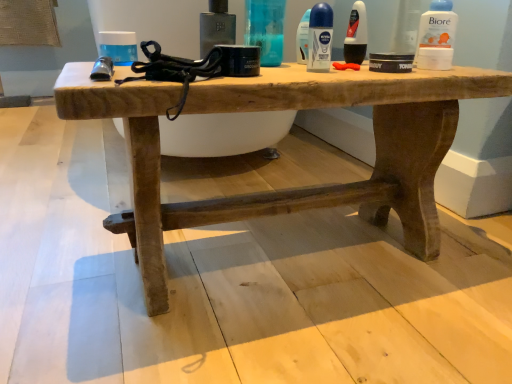
Question: Considering the relative sizes of blue matte deodorant at upper center, acting as the third mouthwash starting from the right, and matte black deodorant at center, the third toiletry viewed from the left, in the image provided, is blue matte deodorant at upper center, acting as the third mouthwash starting from the right, bigger than matte black deodorant at center, the third toiletry viewed from the left,?

Choices:
 (A) yes
 (B) no

Answer: (B)

Question: Considering the relative sizes of blue matte deodorant at upper center, arranged as the first mouthwash when viewed from the back, and matte black deodorant at center, the third toiletry viewed from the left, in the image provided, is blue matte deodorant at upper center, arranged as the first mouthwash when viewed from the back, smaller than matte black deodorant at center, the third toiletry viewed from the left,?

Choices:
 (A) yes
 (B) no

Answer: (A)

Question: Does blue matte deodorant at upper center, acting as the third mouthwash starting from the right, turn towards matte black deodorant at center, placed as the first toiletry when sorted from right to left?

Choices:
 (A) no
 (B) yes

Answer: (A)

Question: Is blue matte deodorant at upper center, arranged as the first mouthwash when viewed from the back, wider than matte black deodorant at center, the third toiletry viewed from the left?

Choices:
 (A) no
 (B) yes

Answer: (A)

Question: From the image's perspective, does blue matte deodorant at upper center, arranged as the first mouthwash when viewed from the back, appear lower than matte black deodorant at center, the third toiletry viewed from the left?

Choices:
 (A) yes
 (B) no

Answer: (A)

Question: Is blue matte deodorant at upper center, which is the 3th mouthwash from front to back, behind matte black deodorant at center, placed as the first toiletry when sorted from right to left?

Choices:
 (A) yes
 (B) no

Answer: (B)

Question: Considering the relative sizes of blue glossy deodorant stick at center, placed as the third mouthwash when sorted from back to front, and translucent plastic bottle at upper center, the second toiletry viewed from the right, in the image provided, is blue glossy deodorant stick at center, placed as the third mouthwash when sorted from back to front, thinner than translucent plastic bottle at upper center, the second toiletry viewed from the right,?

Choices:
 (A) no
 (B) yes

Answer: (B)

Question: Is blue glossy deodorant stick at center, the second mouthwash from the right, outside translucent plastic bottle at upper center, which is the second toiletry from left to right?

Choices:
 (A) no
 (B) yes

Answer: (B)

Question: Could translucent plastic bottle at upper center, which is the second toiletry from left to right, be considered to be inside blue glossy deodorant stick at center, placed as the third mouthwash when sorted from back to front?

Choices:
 (A) no
 (B) yes

Answer: (A)

Question: Are blue glossy deodorant stick at center, placed as the 1th mouthwash when sorted from front to back, and translucent plastic bottle at upper center, the second toiletry viewed from the right, making contact?

Choices:
 (A) no
 (B) yes

Answer: (B)

Question: Is blue glossy deodorant stick at center, the second mouthwash from the right, oriented away from translucent plastic bottle at upper center, which is the second toiletry from left to right?

Choices:
 (A) yes
 (B) no

Answer: (B)

Question: Is blue glossy deodorant stick at center, placed as the third mouthwash when sorted from back to front, far from translucent plastic bottle at upper center, which is the second toiletry from left to right?

Choices:
 (A) yes
 (B) no

Answer: (B)

Question: Is white plastic biore at upper right, which appears as the 3th mouthwash when viewed from the left, wider than matte black deodorant at center, placed as the first toiletry when sorted from right to left?

Choices:
 (A) yes
 (B) no

Answer: (B)